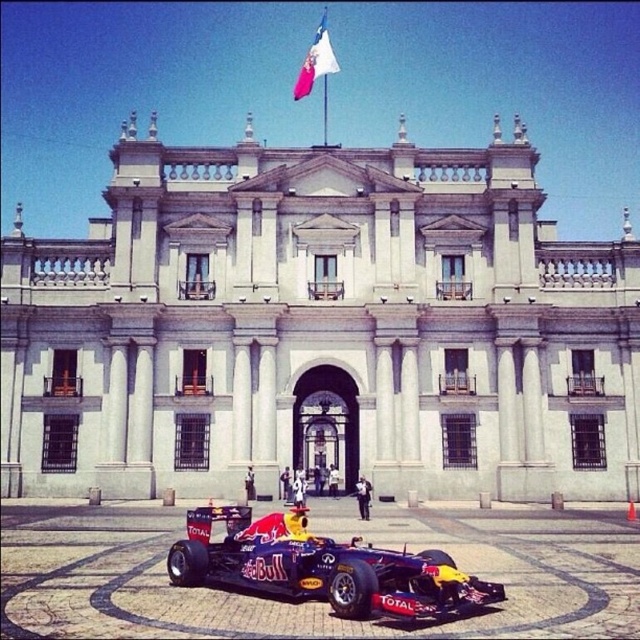
Can you confirm if white stone building at center is taller than white fabric flag at upper center?

Yes.

Between white stone building at center and white fabric flag at upper center, which one is positioned lower?

white stone building at center

What do you see at coordinates (321, 328) in the screenshot?
I see `white stone building at center` at bounding box center [321, 328].

Find the location of a particular element. white stone building at center is located at coordinates (x=321, y=328).

Can you confirm if white stone building at center is wider than shiny red racing car at center?

Yes, white stone building at center is wider than shiny red racing car at center.

Can you confirm if white stone building at center is positioned to the right of shiny red racing car at center?

No, white stone building at center is not to the right of shiny red racing car at center.

Image resolution: width=640 pixels, height=640 pixels. Find the location of `white stone building at center`. white stone building at center is located at coordinates (321, 328).

What are the coordinates of `white stone building at center` in the screenshot? It's located at (321, 328).

Is shiny red racing car at center smaller than white fabric flag at upper center?

No.

From the picture: Who is more forward, (234, 525) or (324, 45)?

Point (234, 525) is in front.

Is point (204, 577) positioned in front of point (292, 90)?

Yes, it is in front of point (292, 90).

Where is `shiny red racing car at center`? shiny red racing car at center is located at coordinates coord(321,566).